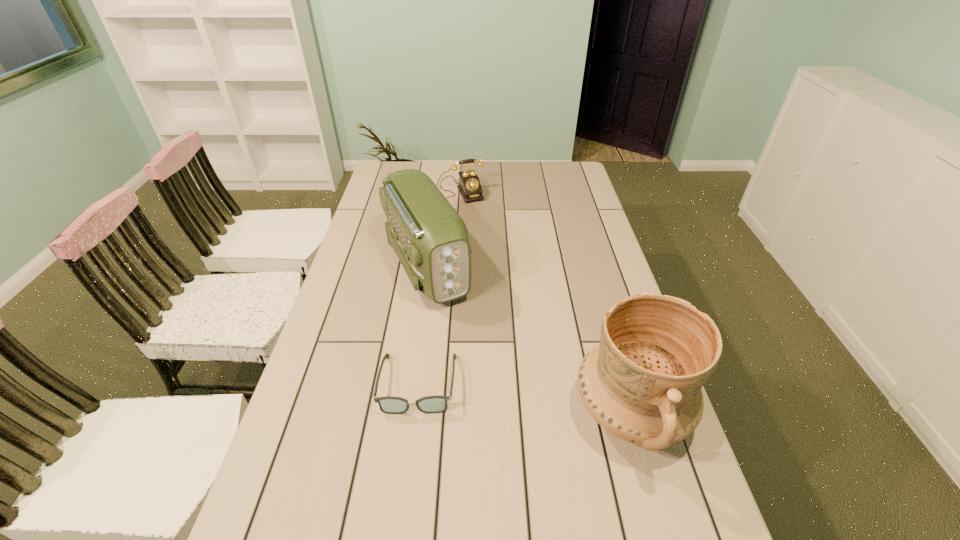
Find the location of a particular element. The width and height of the screenshot is (960, 540). vacant region located 0.250m on the dial of the telephone is located at coordinates (473, 239).

The width and height of the screenshot is (960, 540). I want to click on vacant space situated on the dial of the telephone, so click(468, 227).

You are a GUI agent. You are given a task and a screenshot of the screen. Output one action in this format:
    pyautogui.click(x=<x>, y=<y>)
    Task: Click on the vacant space located 0.170m on the dial of the telephone
    
    Given the screenshot: What is the action you would take?
    pyautogui.click(x=468, y=227)

Where is `object positioned at the far edge`? The image size is (960, 540). object positioned at the far edge is located at coordinates (469, 186).

This screenshot has width=960, height=540. I want to click on radio_receiver present at the left edge, so click(431, 240).

You are a GUI agent. You are given a task and a screenshot of the screen. Output one action in this format:
    pyautogui.click(x=<x>, y=<y>)
    Task: Click on the telephone that is at the left edge
    
    Given the screenshot: What is the action you would take?
    pyautogui.click(x=469, y=186)

The image size is (960, 540). I want to click on object that is at the right edge, so click(x=642, y=383).

The image size is (960, 540). I want to click on object situated at the far left corner, so click(469, 186).

The width and height of the screenshot is (960, 540). In the image, there is a desktop. What are the coordinates of `vacant space at the far edge` in the screenshot? It's located at (503, 168).

In the image, there is a desktop. Where is `vacant space at the left edge`? This screenshot has height=540, width=960. vacant space at the left edge is located at coordinates (386, 232).